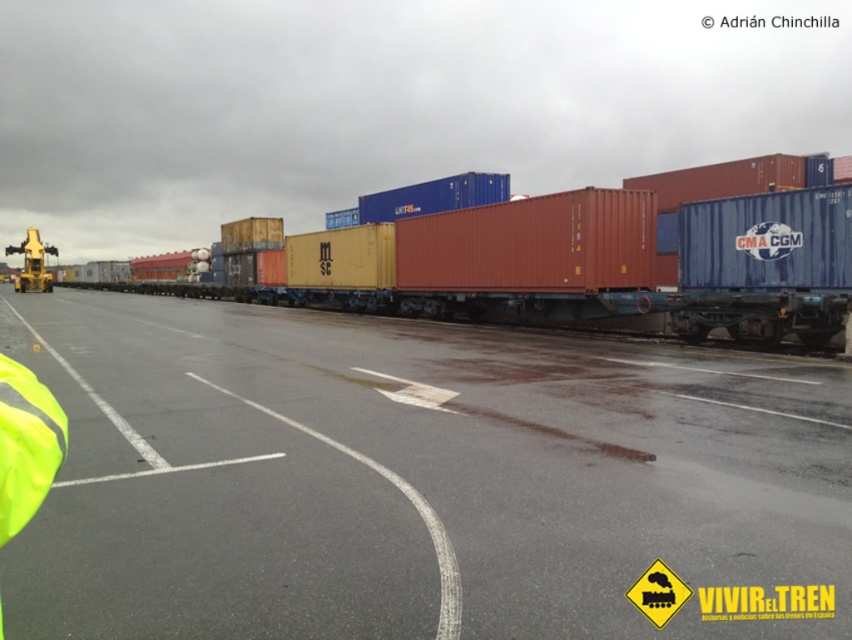
You are a worker in the rail yard and need to determine if the matte red container at center can be safely lifted over the yellow reflective safety vest at lower left. Can it be done without hitting the vest?

The matte red container at center is taller than the yellow reflective safety vest at lower left, so lifting it over the vest would be possible as long as the crane operator maintains proper clearance between the container and the vest.

You are a safety inspector standing at the yellow reflective safety vest at lower left. You need to inspect the matte red container at center. Can you safely reach it without climbing over anything?

The matte red container at center is located above the yellow reflective safety vest at lower left, so you would need to climb over or move around the structure to reach it safely.

Consider the image. You are a worker in the rail yard and need to locate the yellow reflective safety vest at lower left. According to the scene, where should you look relative to the red matte container at center?

The red matte container at center is positioned on the left side of the yellow reflective safety vest at lower left, so you should look to the right of the red matte container at center to find the yellow reflective safety vest at lower left.